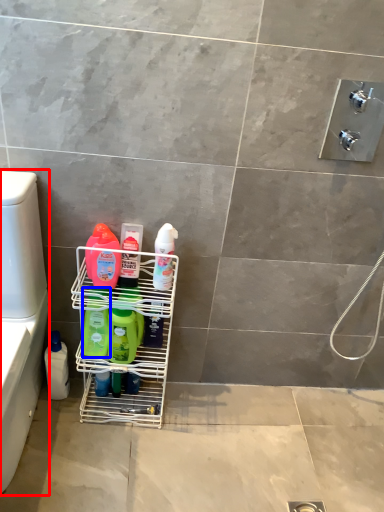
Question: Which object appears farthest to the camera in this image, washer (highlighted by a red box) or cleaning product (highlighted by a blue box)?

Choices:
 (A) washer
 (B) cleaning product

Answer: (B)